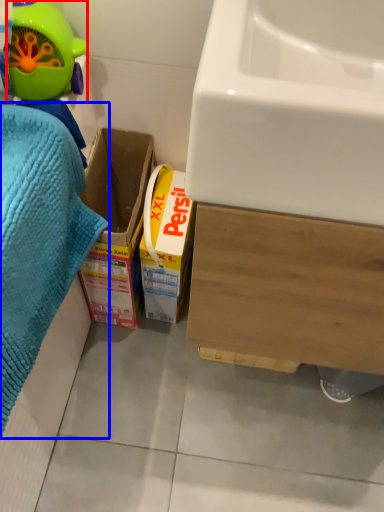
Question: Which object is closer to the camera taking this photo, toy (highlighted by a red box) or bath towel (highlighted by a blue box)?

Choices:
 (A) toy
 (B) bath towel

Answer: (B)